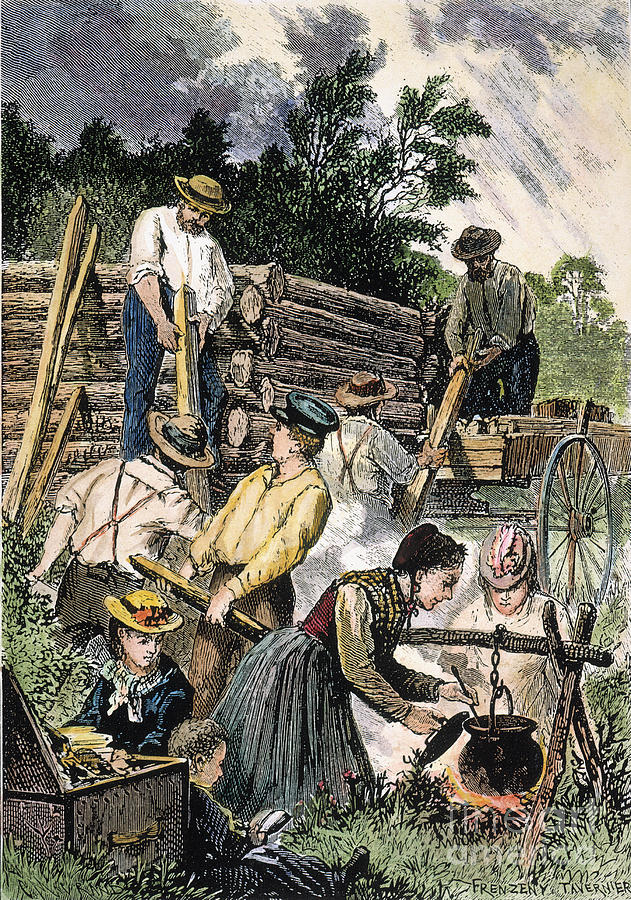
This screenshot has width=631, height=900. In order to click on black kettle in this screenshot , I will do `click(510, 776)`.